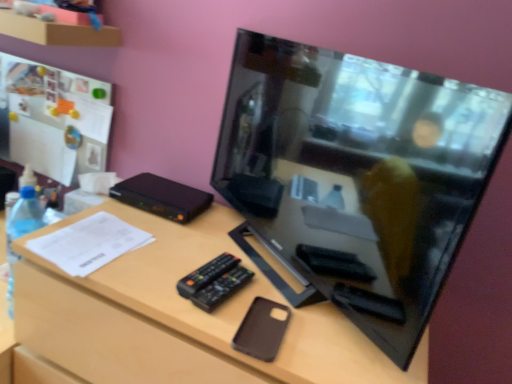
Identify the location of vacant space that's between black plastic remote at center and black glossy television at center. (230, 270).